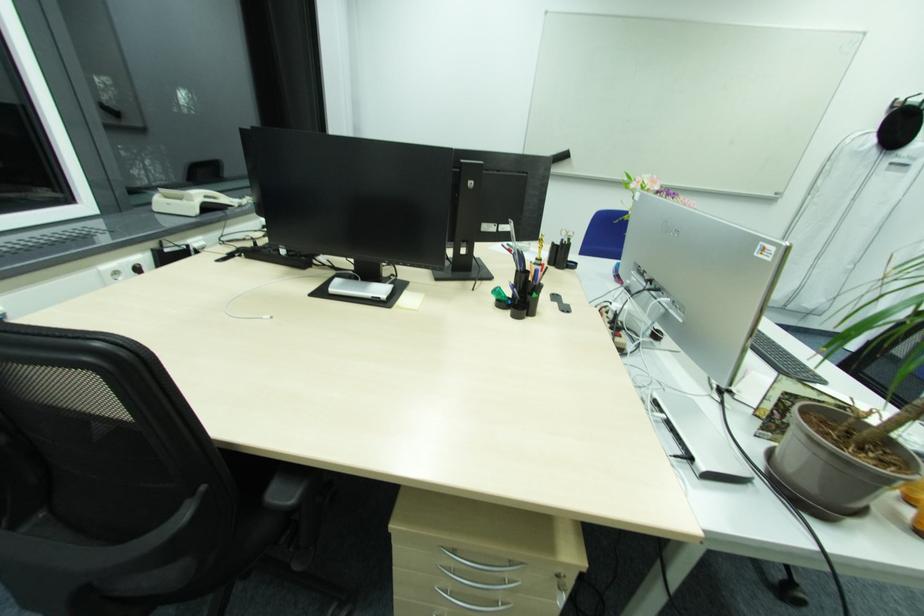
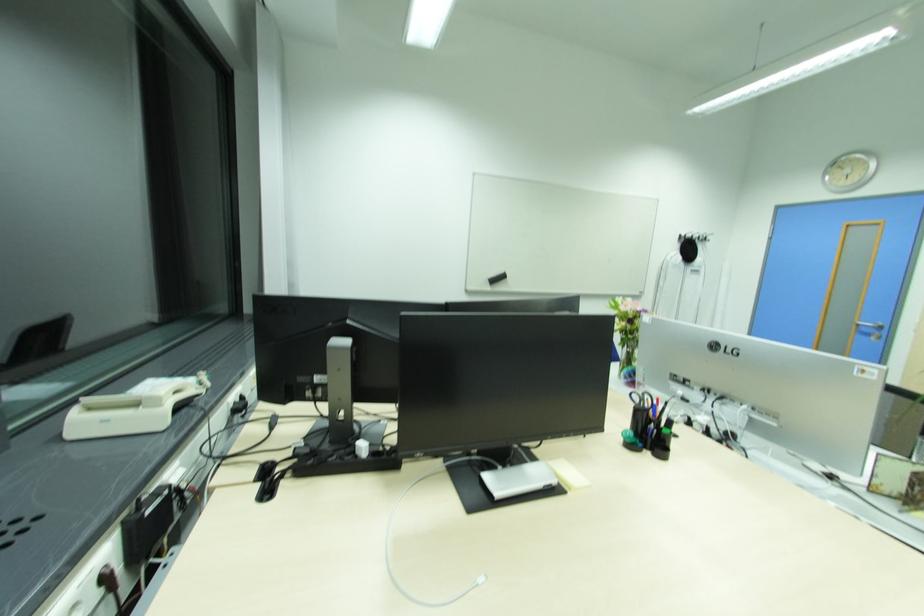
Find the pixel in the second image that matches (881,130) in the first image.

(684, 251)